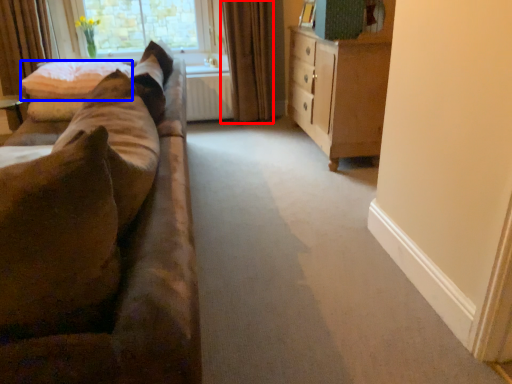
Question: Which object is closer to the camera taking this photo, curtain (highlighted by a red box) or pillow (highlighted by a blue box)?

Choices:
 (A) curtain
 (B) pillow

Answer: (B)